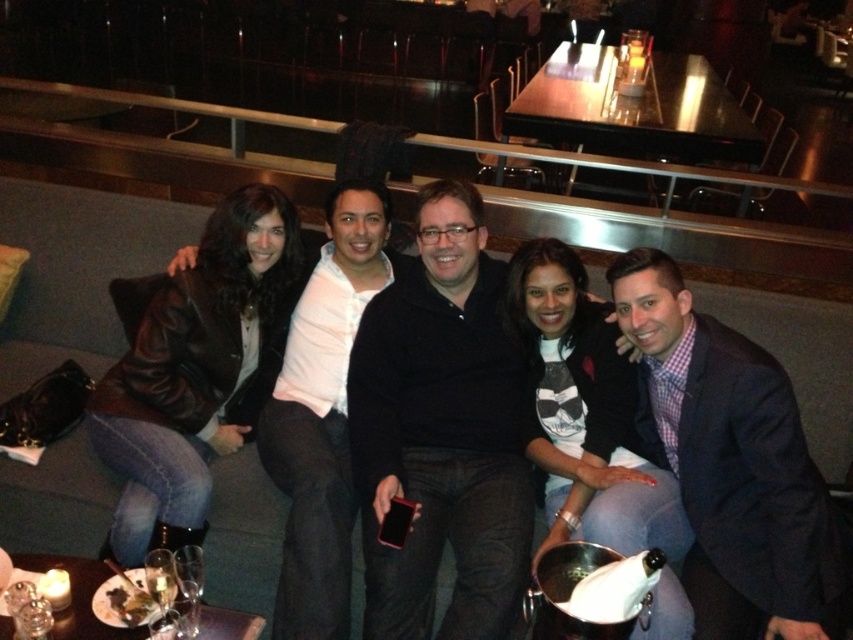
Who is taller, leather jacket at left or matte black jacket at center?

leather jacket at left is taller.

Can you confirm if leather jacket at left is thinner than matte black jacket at center?

Incorrect, leather jacket at left's width is not less than matte black jacket at center's.

This screenshot has width=853, height=640. I want to click on leather jacket at left, so click(x=194, y=369).

The width and height of the screenshot is (853, 640). In order to click on leather jacket at left in this screenshot , I will do `click(194, 369)`.

Who is taller, leather couch at center or dark blue suit at right?

dark blue suit at right is taller.

Does leather couch at center lie behind dark blue suit at right?

That is True.

Between point (286, 506) and point (677, 456), which one is positioned in front?

Point (677, 456) is more forward.

At what (x,y) coordinates should I click in order to perform the action: click on leather couch at center. Please return your answer as a coordinate pair (x, y). Looking at the image, I should click on (77, 269).

Does black matte shirt at center have a greater width compared to leather couch at center?

Incorrect, black matte shirt at center's width does not surpass leather couch at center's.

The width and height of the screenshot is (853, 640). What are the coordinates of `black matte shirt at center` in the screenshot? It's located at (444, 432).

Between point (498, 385) and point (61, 220), which one is positioned in front?

Point (498, 385)

In order to click on black matte shirt at center in this screenshot , I will do `click(444, 432)`.